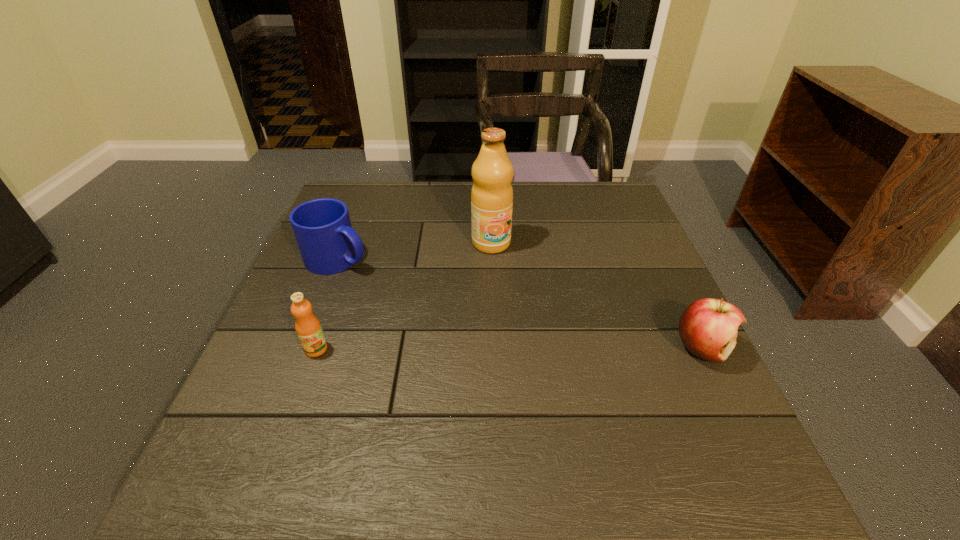
Find the location of a particular element. vacant space at the far right corner of the desktop is located at coordinates (599, 215).

Locate an element on the screen. Image resolution: width=960 pixels, height=540 pixels. free space between the apple and the tallest object is located at coordinates (597, 296).

Where is `free spot between the apple and the orange juice`? This screenshot has height=540, width=960. free spot between the apple and the orange juice is located at coordinates (509, 348).

I want to click on unoccupied position between the apple and the second object from right to left, so click(x=597, y=296).

This screenshot has width=960, height=540. In order to click on free space between the rightmost object and the orange juice in this screenshot , I will do `click(509, 348)`.

Where is `vacant area that lies between the fruit juice and the mug`? vacant area that lies between the fruit juice and the mug is located at coordinates (415, 251).

Identify the location of vacant area that lies between the apple and the mug. The image size is (960, 540). (520, 303).

The width and height of the screenshot is (960, 540). In order to click on vacant space in between the orange juice and the mug in this screenshot , I will do `click(327, 304)`.

Where is `vacant space that is in between the orange juice and the apple`? The width and height of the screenshot is (960, 540). vacant space that is in between the orange juice and the apple is located at coordinates (509, 348).

Where is `vacant point located between the mug and the orange juice`? vacant point located between the mug and the orange juice is located at coordinates (327, 304).